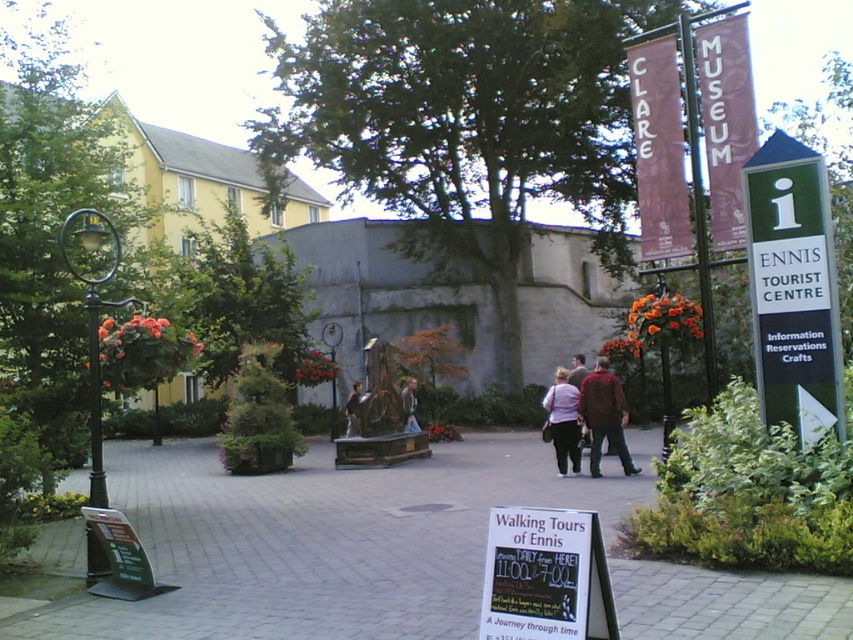
You are a tourist standing in the Clare Museum courtyard. You see a bronze statue at center and a striped fabric jacket at center. Which object is taller?

The striped fabric jacket at center is taller than the bronze statue at center.

You are a tourist standing in the Clare Museum courtyard. You see the paved stone at center and the green plastic sign at right. Which object is closer to the ground?

The paved stone at center is below green plastic sign at right, so the paved stone at center is closer to the ground.